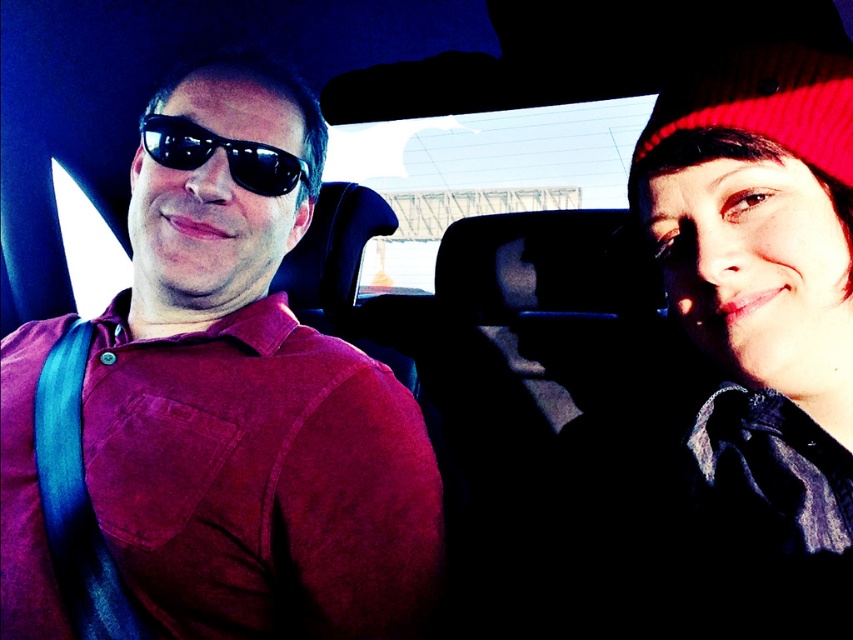
Question: Can you confirm if matte black sunglasses at left is bigger than black reflective sunglasses at left?

Choices:
 (A) yes
 (B) no

Answer: (A)

Question: Which point is closer to the camera?

Choices:
 (A) (434, 540)
 (B) (294, 166)

Answer: (B)

Question: Among these points, which one is nearest to the camera?

Choices:
 (A) (328, 372)
 (B) (746, 49)

Answer: (B)

Question: From the image, what is the correct spatial relationship of red knit hat at upper right in relation to black reflective sunglasses at left?

Choices:
 (A) right
 (B) left

Answer: (A)

Question: Is matte black sunglasses at left to the right of black reflective sunglasses at left from the viewer's perspective?

Choices:
 (A) no
 (B) yes

Answer: (A)

Question: Estimate the real-world distances between objects in this image. Which object is closer to the matte black sunglasses at left?

Choices:
 (A) black reflective sunglasses at left
 (B) red knit hat at upper right
 (C) knitted red beanie at upper right

Answer: (A)